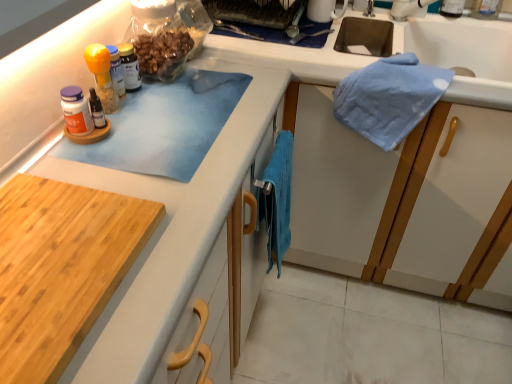
Question: Is blue fabric towel at upper right facing away from wooden cutting board at lower left?

Choices:
 (A) yes
 (B) no

Answer: (B)

Question: Is blue fabric towel at upper right shorter than wooden cutting board at lower left?

Choices:
 (A) yes
 (B) no

Answer: (B)

Question: Does blue fabric towel at upper right come in front of wooden cutting board at lower left?

Choices:
 (A) no
 (B) yes

Answer: (A)

Question: From a real-world perspective, is blue fabric towel at upper right on top of wooden cutting board at lower left?

Choices:
 (A) yes
 (B) no

Answer: (B)

Question: From the image's perspective, is blue fabric towel at upper right on top of wooden cutting board at lower left?

Choices:
 (A) no
 (B) yes

Answer: (B)

Question: Is blue cotton towel at center to the left or to the right of blue fabric towel at upper right in the image?

Choices:
 (A) left
 (B) right

Answer: (A)

Question: Considering the positions of blue cotton towel at center and blue fabric towel at upper right in the image, is blue cotton towel at center wider or thinner than blue fabric towel at upper right?

Choices:
 (A) thin
 (B) wide

Answer: (A)

Question: Looking at the image, does blue cotton towel at center seem bigger or smaller compared to blue fabric towel at upper right?

Choices:
 (A) small
 (B) big

Answer: (A)

Question: Choose the correct answer: Is blue cotton towel at center inside blue fabric towel at upper right or outside it?

Choices:
 (A) inside
 (B) outside

Answer: (B)

Question: From the image's perspective, relative to translucent plastic bottle at center, is wooden cutting board at lower left above or below?

Choices:
 (A) below
 (B) above

Answer: (A)

Question: In the image, is wooden cutting board at lower left positioned in front of or behind translucent plastic bottle at center?

Choices:
 (A) behind
 (B) front

Answer: (B)

Question: Visually, is wooden cutting board at lower left positioned to the left or to the right of translucent plastic bottle at center?

Choices:
 (A) left
 (B) right

Answer: (A)

Question: Is point (31, 349) closer or farther from the camera than point (126, 61)?

Choices:
 (A) closer
 (B) farther

Answer: (A)

Question: Is blue fabric towel at upper right in front of or behind wooden cutting board at lower left in the image?

Choices:
 (A) front
 (B) behind

Answer: (B)

Question: Is blue fabric towel at upper right situated inside wooden cutting board at lower left or outside?

Choices:
 (A) outside
 (B) inside

Answer: (A)